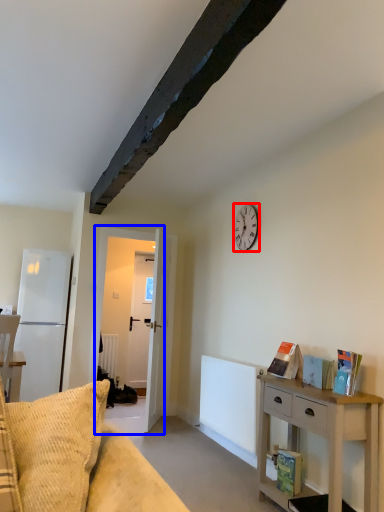
Question: Which object is closer to the camera taking this photo, clock (highlighted by a red box) or door (highlighted by a blue box)?

Choices:
 (A) clock
 (B) door

Answer: (A)